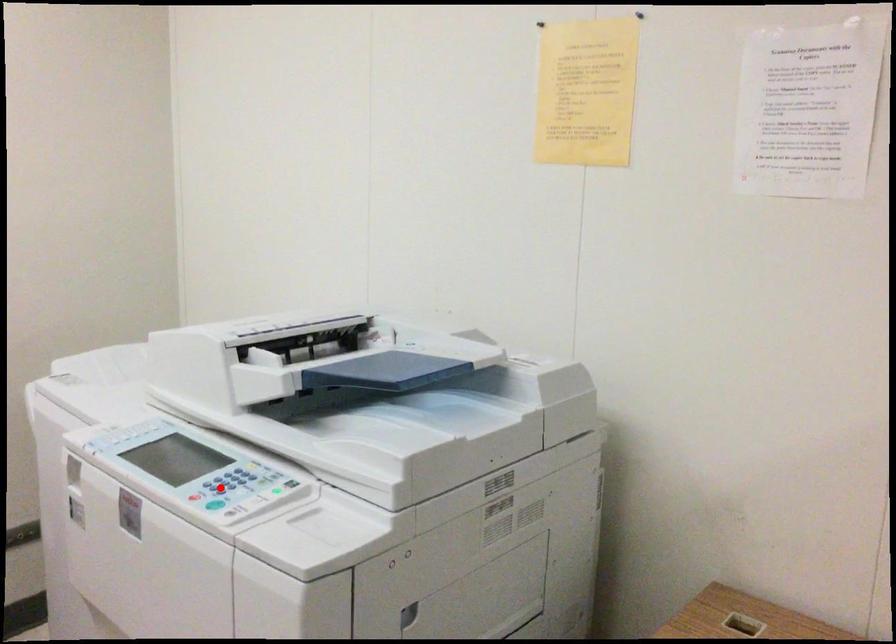
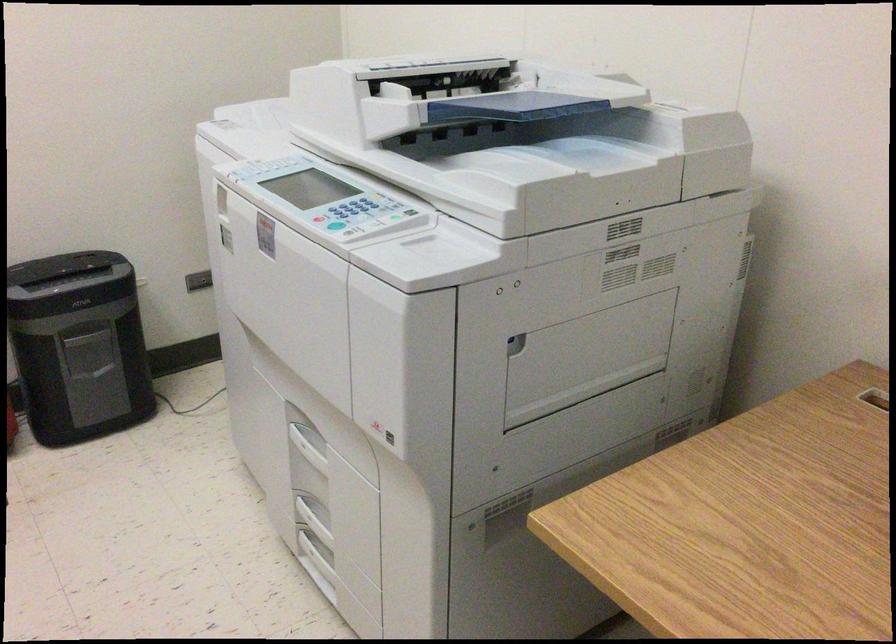
Locate, in the second image, the point that corresponds to the highlighted location in the first image.

(343, 214)